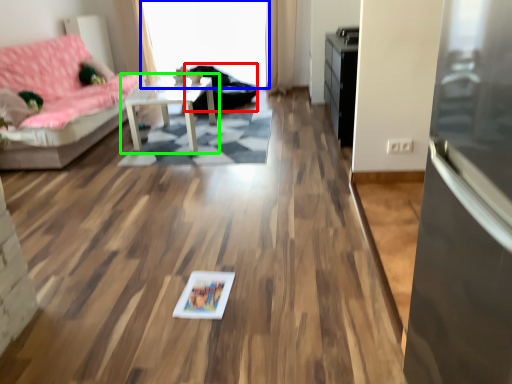
Question: Based on their relative distances, which object is farther from armchair (highlighted by a red box)? Choose from window screen (highlighted by a blue box) and table (highlighted by a green box).

Choices:
 (A) window screen
 (B) table

Answer: (B)